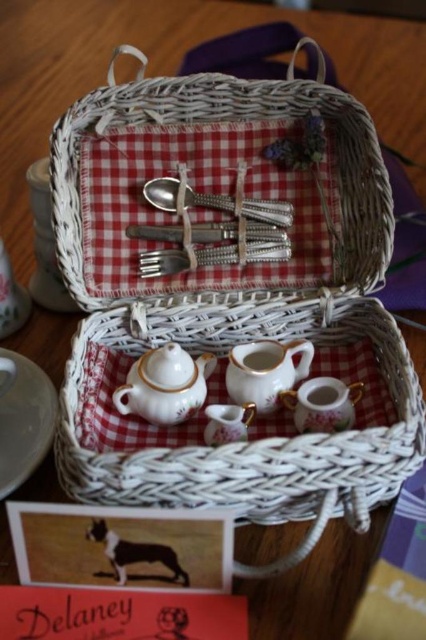
Between point (32, 460) and point (322, 400), which one is positioned in front?

Point (32, 460)

Is white glossy saucer at lower left wider than matte porcelain teacup at center?

Yes.

What are the coordinates of `white glossy saucer at lower left` in the screenshot? It's located at tap(23, 419).

Who is higher up, porcelain teacup at lower center or matte porcelain teacup at center?

porcelain teacup at lower center is above.

Is porcelain teacup at lower center in front of matte porcelain teacup at center?

Yes.

Describe the element at coordinates (265, 371) in the screenshot. I see `porcelain teacup at lower center` at that location.

Identify the location of porcelain teacup at lower center. (265, 371).

Does white porcelain teapot at center have a greater width compared to porcelain teacup at lower center?

Yes.

Between point (144, 397) and point (256, 362), which one is positioned in front?

Positioned in front is point (144, 397).

Image resolution: width=426 pixels, height=640 pixels. Find the location of `white porcelain teapot at center`. white porcelain teapot at center is located at coordinates (164, 385).